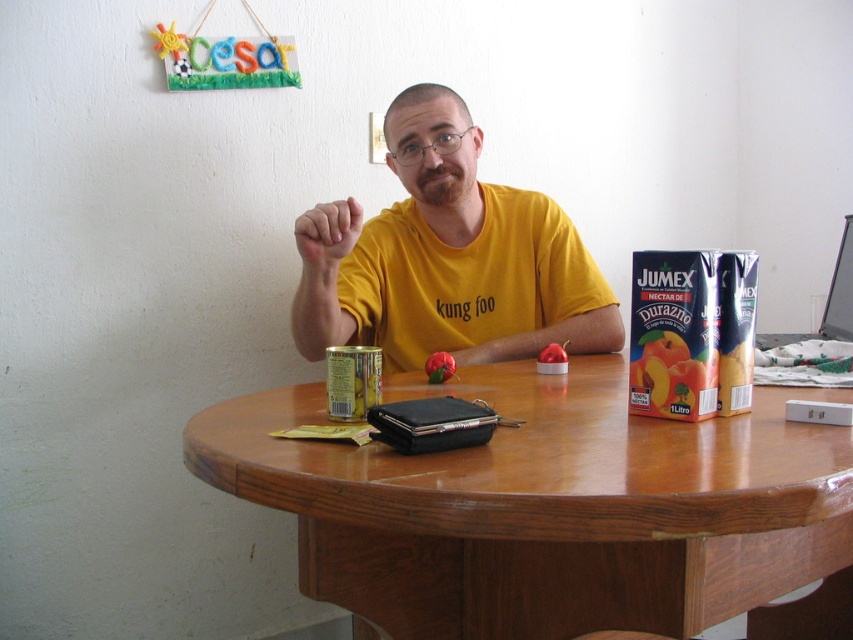
Can you confirm if wooden at center is taller than yellow matte shirt at center?

No.

Is point (368, 621) closer to camera compared to point (416, 156)?

Yes, point (368, 621) is in front of point (416, 156).

Where is `wooden at center`? The height and width of the screenshot is (640, 853). wooden at center is located at coordinates pos(544,506).